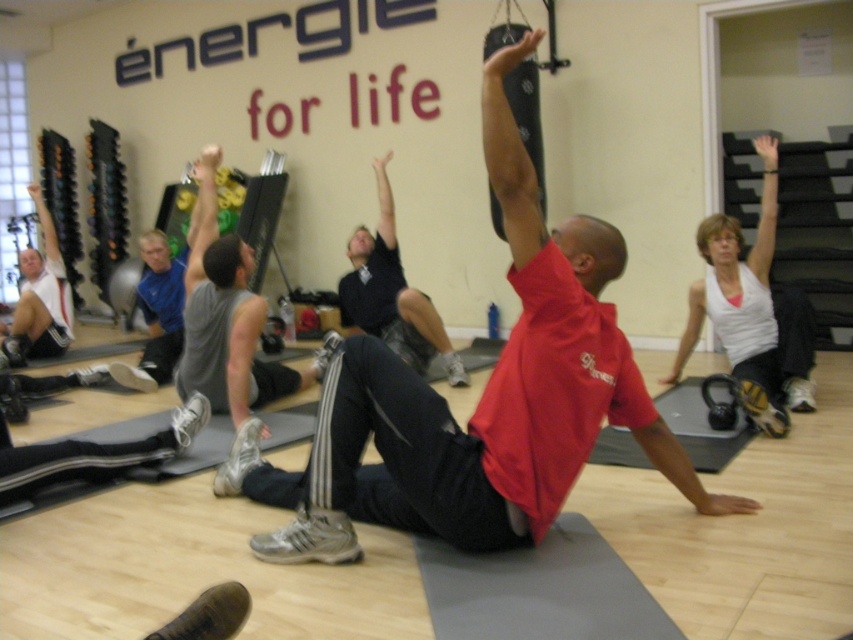
Who is positioned more to the right, red matte shirt at center or dark blue shirt at center?

Positioned to the right is red matte shirt at center.

Who is lower down, red matte shirt at center or dark blue shirt at center?

red matte shirt at center is lower down.

Between point (570, 244) and point (434, 308), which one is positioned behind?

The point (434, 308) is more distant.

Where is `red matte shirt at center`? red matte shirt at center is located at coordinates (479, 401).

Which is behind, point (709, 236) or point (57, 292)?

The point (57, 292) is more distant.

Locate an element on the screen. white matte tank top at upper right is located at coordinates (741, 304).

I want to click on white matte tank top at upper right, so click(741, 304).

Which is above, red matte shirt at center or white matte tank top at left?

Positioned higher is white matte tank top at left.

Between point (611, 241) and point (42, 196), which one is positioned in front?

Point (611, 241)

Is point (462, 484) closer to viewer compared to point (54, 248)?

Yes, point (462, 484) is closer to viewer.

You are a GUI agent. You are given a task and a screenshot of the screen. Output one action in this format:
    pyautogui.click(x=<x>, y=<y>)
    Task: Click on the red matte shirt at center
    This screenshot has width=853, height=640.
    Given the screenshot: What is the action you would take?
    pyautogui.click(x=479, y=401)